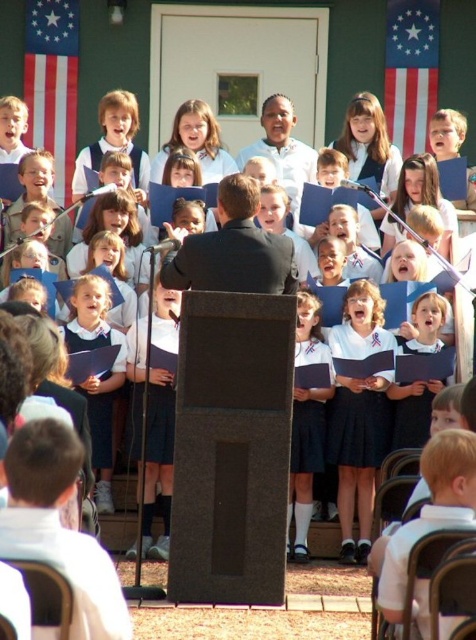
Question: Does american flag at upper left appear on the right side of red fabric flag at upper right?

Choices:
 (A) no
 (B) yes

Answer: (A)

Question: Which point appears farthest from the camera in this image?

Choices:
 (A) (56, 29)
 (B) (426, 3)

Answer: (A)

Question: Is american flag at upper left bigger than red fabric flag at upper right?

Choices:
 (A) no
 (B) yes

Answer: (B)

Question: Is american flag at upper left bigger than red fabric flag at upper right?

Choices:
 (A) no
 (B) yes

Answer: (B)

Question: Which point is farther to the camera?

Choices:
 (A) red fabric flag at upper right
 (B) american flag at upper left

Answer: (A)